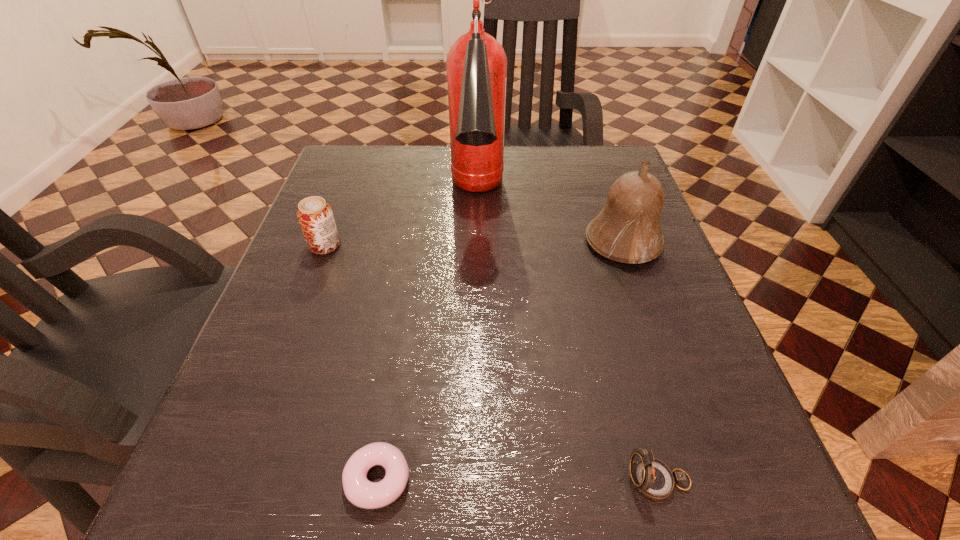
Image resolution: width=960 pixels, height=540 pixels. I want to click on vacant space located 0.230m on the right of the beer can, so click(x=455, y=246).

The width and height of the screenshot is (960, 540). In order to click on vacant point located 0.160m on the face of the compass in this screenshot , I will do `click(502, 481)`.

Locate an element on the screen. free space located 0.390m on the face of the compass is located at coordinates (323, 481).

Where is `free location located 0.100m on the face of the compass`? free location located 0.100m on the face of the compass is located at coordinates (549, 481).

You are a GUI agent. You are given a task and a screenshot of the screen. Output one action in this format:
    pyautogui.click(x=<x>, y=<y>)
    Task: Click on the free space located on the left of the shortest object
    This screenshot has height=540, width=960.
    Given the screenshot: What is the action you would take?
    pyautogui.click(x=282, y=479)

You are a GUI agent. You are given a task and a screenshot of the screen. Output one action in this format:
    pyautogui.click(x=<x>, y=<y>)
    Task: Click on the object at the far edge
    Image resolution: width=960 pixels, height=540 pixels.
    Given the screenshot: What is the action you would take?
    pyautogui.click(x=476, y=63)

The height and width of the screenshot is (540, 960). Find the location of `compass at the near edge`. compass at the near edge is located at coordinates (653, 478).

The image size is (960, 540). Find the location of `doughnut that is at the near edge`. doughnut that is at the near edge is located at coordinates (362, 493).

Where is `object that is at the left edge`? object that is at the left edge is located at coordinates (315, 216).

Locate an element on the screen. This screenshot has width=960, height=540. bell located in the right edge section of the desktop is located at coordinates (627, 229).